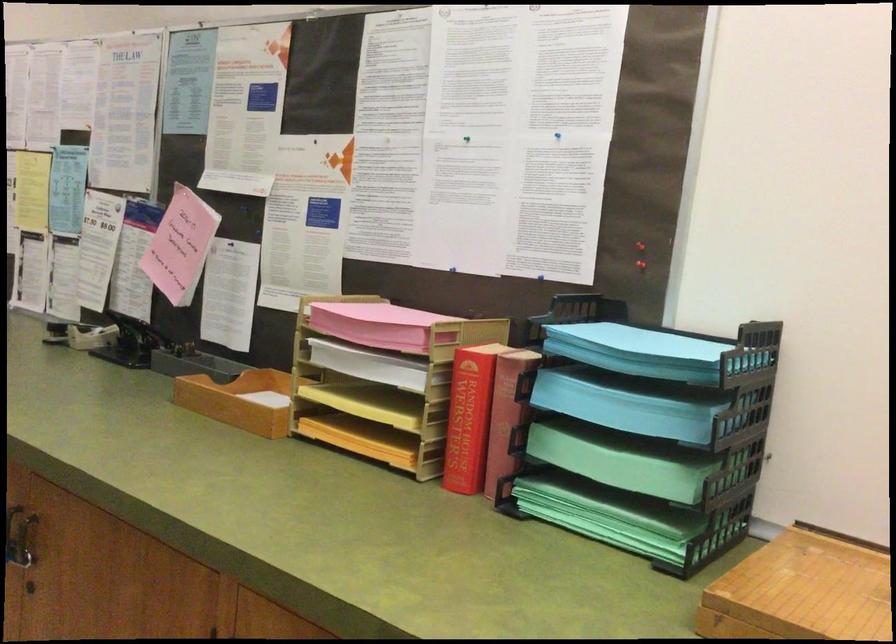
This screenshot has height=644, width=896. Describe the element at coordinates (367, 404) in the screenshot. I see `the stack of yellow paper` at that location.